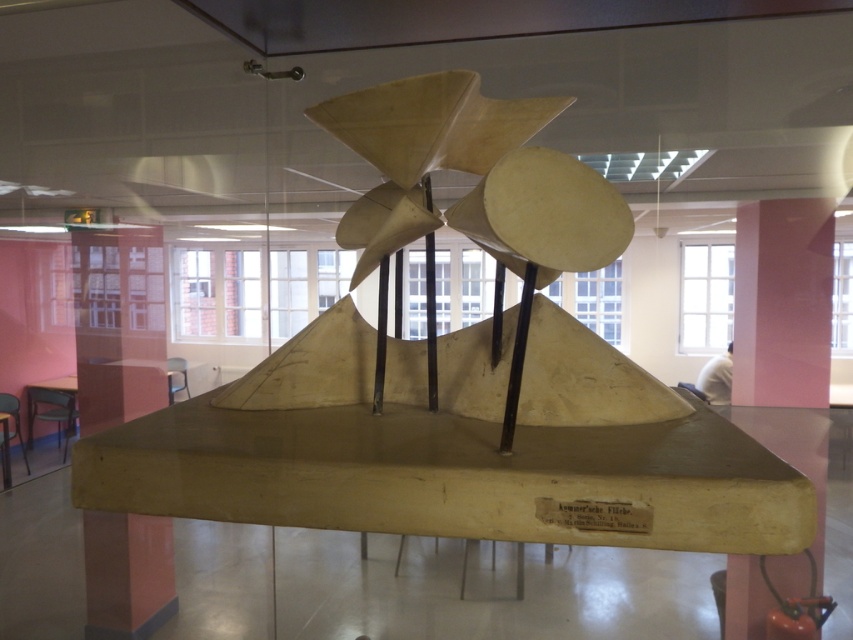
Question: Which of the following is the closest to the observer?

Choices:
 (A) transparent glass pillar at left
 (B) pink matte/wooden pillar at right

Answer: (B)

Question: Which of the following is the closest to the observer?

Choices:
 (A) (741, 257)
 (B) (126, 536)

Answer: (B)

Question: Does pink matte/wooden pillar at right appear under transparent glass pillar at left?

Choices:
 (A) yes
 (B) no

Answer: (A)

Question: Does pink matte/wooden pillar at right appear on the left side of transparent glass pillar at left?

Choices:
 (A) no
 (B) yes

Answer: (A)

Question: Is the position of pink matte/wooden pillar at right less distant than that of transparent glass pillar at left?

Choices:
 (A) yes
 (B) no

Answer: (A)